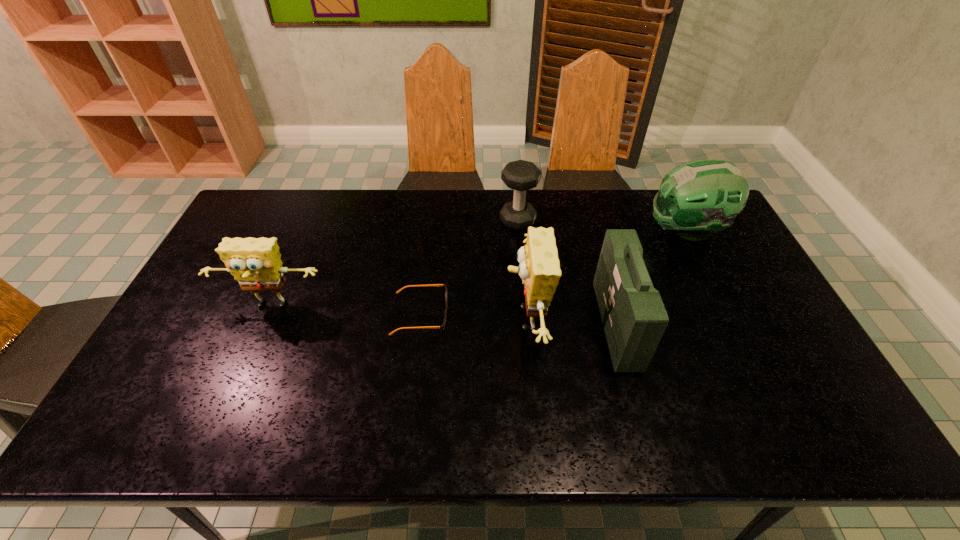
Find the location of a particular element. The height and width of the screenshot is (540, 960). dumbbell present at the far edge is located at coordinates (520, 175).

Locate an element on the screen. football helmet situated at the far edge is located at coordinates (697, 198).

Locate an element on the screen. The width and height of the screenshot is (960, 540). sponge that is at the near edge is located at coordinates click(539, 268).

This screenshot has height=540, width=960. What are the coordinates of `the first-aid kit present at the near edge` in the screenshot? It's located at (634, 318).

Identify the location of object positioned at the left edge. (255, 263).

The width and height of the screenshot is (960, 540). Find the location of `object that is at the right edge`. object that is at the right edge is located at coordinates (697, 198).

Identify the location of object at the far right corner. This screenshot has width=960, height=540. (697, 198).

In the image, there is a desktop. At what (x,y) coordinates should I click in order to perform the action: click on free region at the far edge. Please return your answer as a coordinate pair (x, y). This screenshot has height=540, width=960. Looking at the image, I should click on (344, 212).

You are a GUI agent. You are given a task and a screenshot of the screen. Output one action in this format:
    pyautogui.click(x=<x>, y=<y>)
    Task: Click on the vacant position at the near edge of the desktop
    
    Given the screenshot: What is the action you would take?
    pyautogui.click(x=276, y=395)

Where is `vacant region at the left edge of the desktop`? vacant region at the left edge of the desktop is located at coordinates (183, 320).